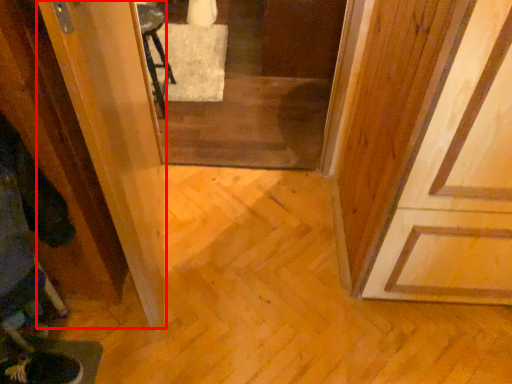
Question: From the image's perspective, what is the correct spatial positioning of screen door (annotated by the red box) in reference to screen door?

Choices:
 (A) below
 (B) above

Answer: (A)